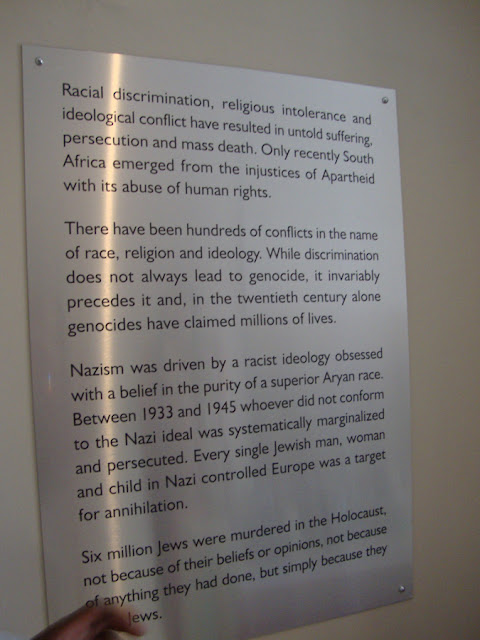
At what (x,y) coordinates should I click in order to perform the action: click on poster holder. Please return your answer as a coordinate pair (x, y). The height and width of the screenshot is (640, 480). Looking at the image, I should click on (402, 591), (386, 98), (37, 61).